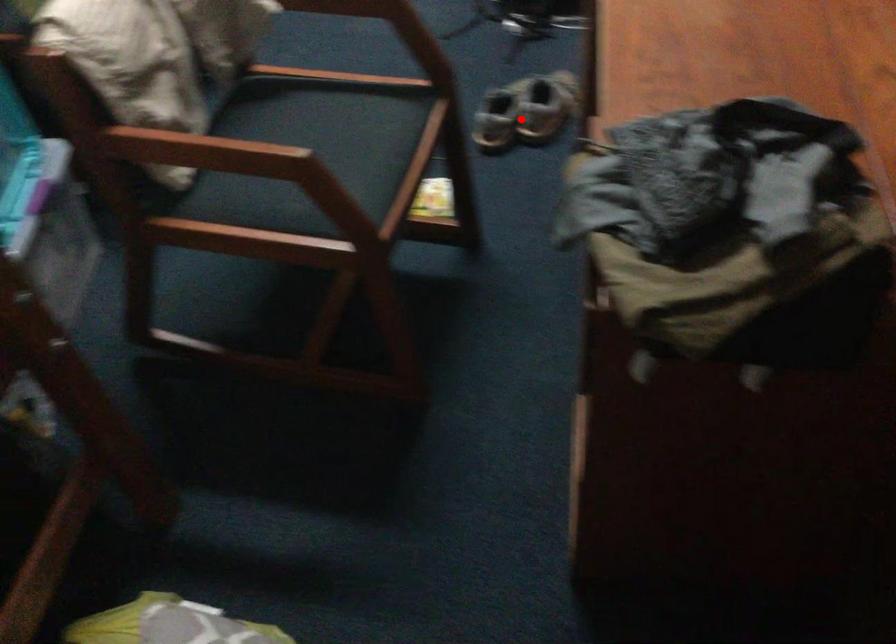
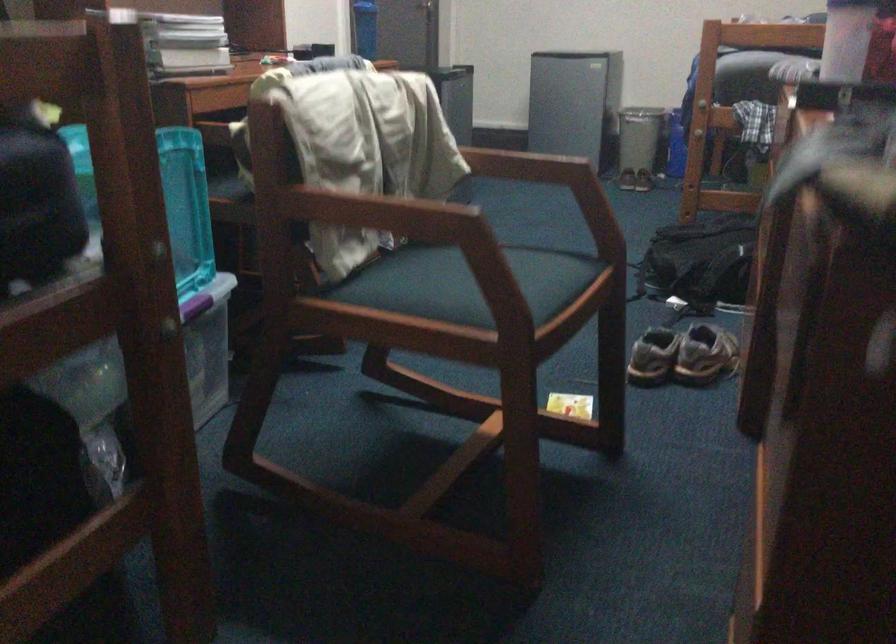
In the second image, find the point that corresponds to the highlighted location in the first image.

(682, 355)